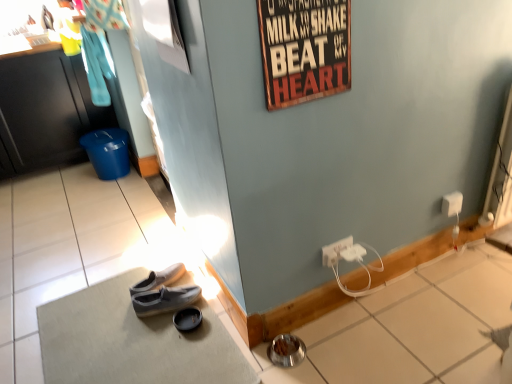
Question: From a real-world perspective, is white plastic power outlet at lower right, which is the 3th power outlet in back-to-front order, physically located above or below white plastic power outlet at lower right, positioned as the second power outlet in back-to-front order?

Choices:
 (A) below
 (B) above

Answer: (A)

Question: Is point (352, 258) closer or farther from the camera than point (348, 241)?

Choices:
 (A) closer
 (B) farther

Answer: (B)

Question: Which of these objects is positioned farthest from the gray suede shoes at lower center, which is the 1th footwear from left to right?

Choices:
 (A) blue plastic trash can at left
 (B) matte gray shoe at center, the first footwear viewed from the right
 (C) white plastic power outlet at lower right, positioned as the second power outlet in back-to-front order
 (D) wooden signboard at upper center
 (E) white plastic power outlet at lower right, which is the second power outlet in right-to-left order

Answer: (A)

Question: Which object is positioned farthest from the white plastic power outlet at lower right, which appears as the second power outlet when ordered from the bottom?

Choices:
 (A) gray suede shoes at lower center, which is the 1th footwear from left to right
 (B) matte gray shoe at center, the first footwear viewed from the right
 (C) gray fabric doormat at lower left
 (D) white plastic power outlet at lower right, which is the 3th power outlet from top to bottom
 (E) wooden signboard at upper center

Answer: (C)